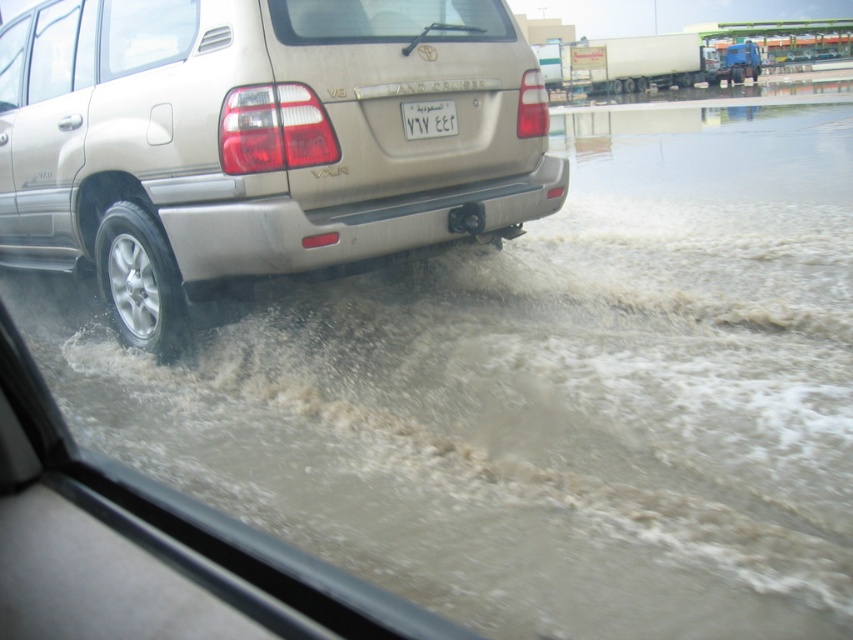
Which of these two, satin beige suv at center or white plastic license plate at center, stands shorter?

With less height is white plastic license plate at center.

Is the position of satin beige suv at center less distant than that of white plastic license plate at center?

Yes, satin beige suv at center is closer to the viewer.

Between point (178, 353) and point (442, 132), which one is positioned in front?

Point (442, 132)

Locate an element on the screen. satin beige suv at center is located at coordinates (257, 141).